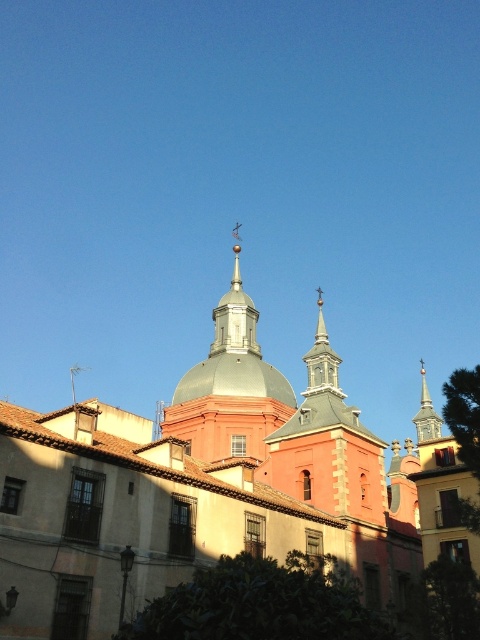
Question: Does smooth gray dome at center appear on the left side of smooth gray spire at upper right?

Choices:
 (A) yes
 (B) no

Answer: (A)

Question: Can you confirm if smooth gray dome at center is positioned to the left of smooth gray spire at upper right?

Choices:
 (A) no
 (B) yes

Answer: (B)

Question: Can you confirm if metallic dome at center is positioned below smooth gray spire at upper right?

Choices:
 (A) no
 (B) yes

Answer: (A)

Question: Which object is positioned closest to the metallic dome at center?

Choices:
 (A) smooth gray spire at upper right
 (B) smooth gray dome at center

Answer: (B)

Question: Estimate the real-world distances between objects in this image. Which object is closer to the smooth gray spire at upper right?

Choices:
 (A) metallic dome at center
 (B) smooth gray dome at center

Answer: (A)

Question: Based on their relative distances, which object is farther from the smooth gray dome at center?

Choices:
 (A) metallic dome at center
 (B) smooth gray spire at upper right

Answer: (B)